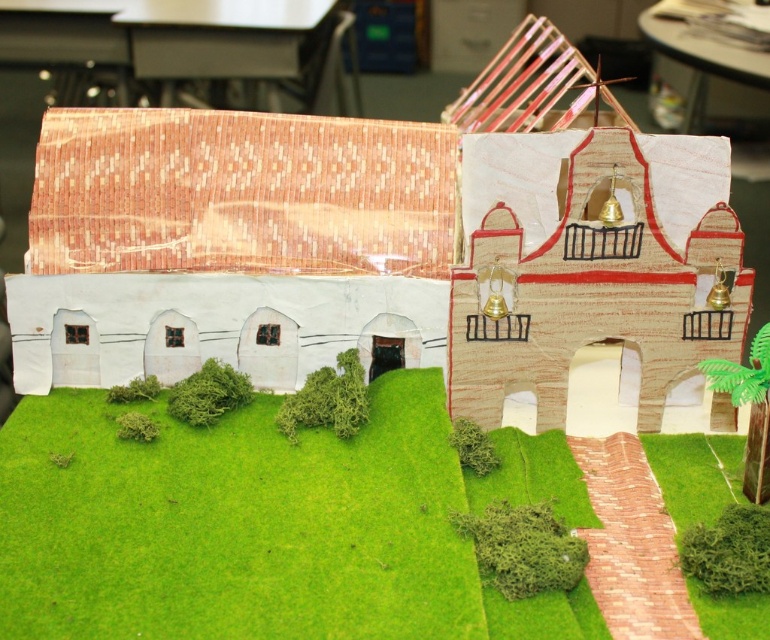
In the scene shown: Between green artificial turf at lower center and cardboard model building at center, which one appears on the left side from the viewer's perspective?

Positioned to the left is green artificial turf at lower center.

Does green artificial turf at lower center appear on the right side of cardboard model building at center?

In fact, green artificial turf at lower center is to the left of cardboard model building at center.

Between point (755, 600) and point (206, 147), which one is positioned in front?

Point (755, 600)

This screenshot has width=770, height=640. I want to click on green artificial turf at lower center, so click(268, 525).